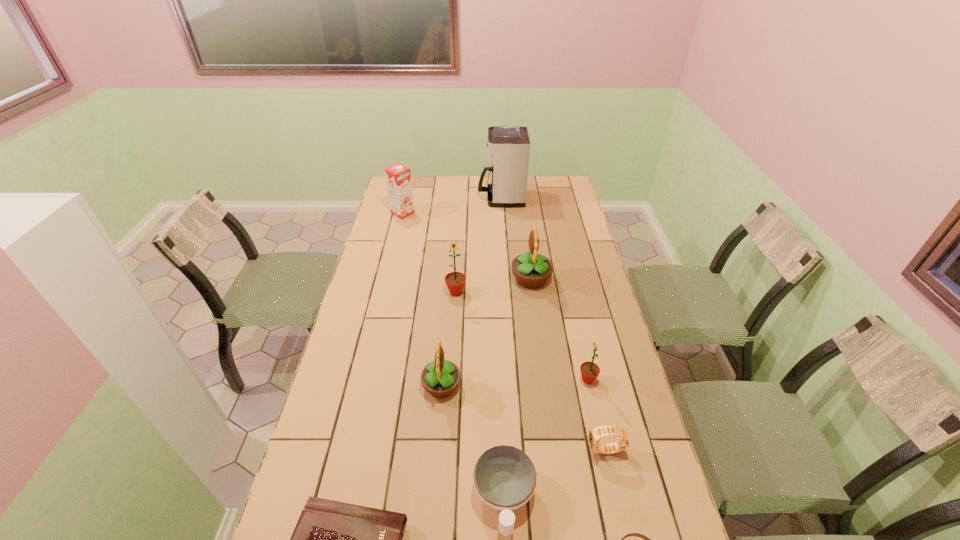
Locate an element on the screen. This screenshot has width=960, height=540. vacant region located 0.220m on the face of the smaller green sunflower is located at coordinates (506, 380).

You are a GUI agent. You are given a task and a screenshot of the screen. Output one action in this format:
    pyautogui.click(x=<x>, y=<y>)
    Task: Click on the free space located on the face of the smaller green sunflower
    The image size is (960, 540).
    Given the screenshot: What is the action you would take?
    pyautogui.click(x=519, y=380)

Where is `free space located 0.090m on the face of the smaller green sunflower`? free space located 0.090m on the face of the smaller green sunflower is located at coordinates (549, 380).

This screenshot has height=540, width=960. Identify the location of vacant area located on the face of the watch. (555, 450).

The height and width of the screenshot is (540, 960). I want to click on vacant space located 0.280m on the face of the watch, so click(484, 450).

Image resolution: width=960 pixels, height=540 pixels. I want to click on vacant area located on the face of the watch, so click(x=461, y=450).

The image size is (960, 540). Find the location of `object located at the far edge`. object located at the far edge is located at coordinates (508, 146).

The height and width of the screenshot is (540, 960). What are the coordinates of `object positioned at the left edge` in the screenshot? It's located at (398, 177).

Where is `sunflower present at the right edge`? This screenshot has height=540, width=960. sunflower present at the right edge is located at coordinates (589, 371).

This screenshot has width=960, height=540. Find the location of `watch at the right edge`. watch at the right edge is located at coordinates (595, 434).